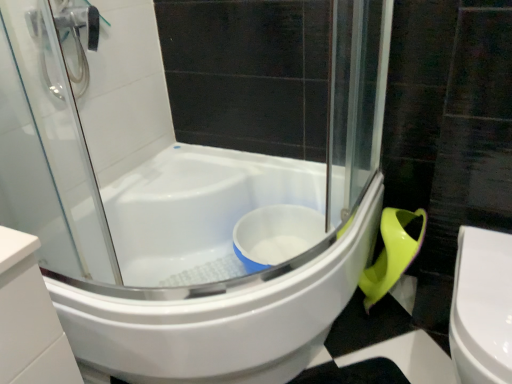
Question: Are white glossy bathtub at center and white glossy toilet at lower right far apart?

Choices:
 (A) yes
 (B) no

Answer: (B)

Question: From a real-world perspective, is white glossy bathtub at center physically above white glossy toilet at lower right?

Choices:
 (A) no
 (B) yes

Answer: (A)

Question: Is the depth of white glossy bathtub at center greater than that of white glossy toilet at lower right?

Choices:
 (A) no
 (B) yes

Answer: (B)

Question: From a real-world perspective, is white glossy bathtub at center physically below white glossy toilet at lower right?

Choices:
 (A) yes
 (B) no

Answer: (A)

Question: Is white glossy bathtub at center completely or partially outside of white glossy toilet at lower right?

Choices:
 (A) yes
 (B) no

Answer: (A)

Question: From the image's perspective, does white glossy bathtub at center appear lower than white glossy toilet at lower right?

Choices:
 (A) yes
 (B) no

Answer: (B)

Question: Is white glossy bathtub at center at the back of white glossy toilet at lower right?

Choices:
 (A) yes
 (B) no

Answer: (B)

Question: Is white glossy toilet at lower right further to the viewer compared to white glossy bathtub at center?

Choices:
 (A) yes
 (B) no

Answer: (B)

Question: Considering the relative sizes of white glossy toilet at lower right and white glossy bathtub at center in the image provided, is white glossy toilet at lower right wider than white glossy bathtub at center?

Choices:
 (A) yes
 (B) no

Answer: (B)

Question: Is white glossy toilet at lower right taller than white glossy bathtub at center?

Choices:
 (A) yes
 (B) no

Answer: (A)

Question: Does white glossy toilet at lower right have a lesser width compared to white glossy bathtub at center?

Choices:
 (A) yes
 (B) no

Answer: (A)

Question: From the image's perspective, is white glossy toilet at lower right located beneath white glossy bathtub at center?

Choices:
 (A) yes
 (B) no

Answer: (A)

Question: From a real-world perspective, is white glossy bathtub at center physically located above or below white glossy toilet at lower right?

Choices:
 (A) above
 (B) below

Answer: (B)